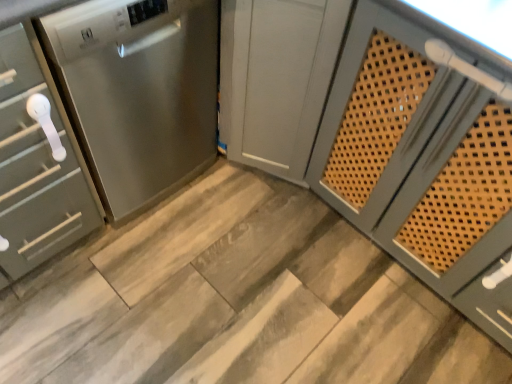
Where is `stainless steel dishwasher at left`? This screenshot has width=512, height=384. stainless steel dishwasher at left is located at coordinates (138, 92).

The image size is (512, 384). What do you see at coordinates (36, 168) in the screenshot?
I see `satin silver cabinet at left, which ranks as the 2th cabinetry in right-to-left order` at bounding box center [36, 168].

Measure the distance between point (x=334, y=167) and camera.

Point (x=334, y=167) and camera are 4.49 feet apart.

Locate an element on the screen. The height and width of the screenshot is (384, 512). stainless steel dishwasher at left is located at coordinates (138, 92).

What's the angular difference between wooden at center and satin silver cabinet at left, which ranks as the 2th cabinetry in right-to-left order,'s facing directions?

They differ by 90.1 degrees in their facing directions.

How far apart are wooden at center and satin silver cabinet at left, which is the 1th cabinetry in left-to-right order?

wooden at center and satin silver cabinet at left, which is the 1th cabinetry in left-to-right order, are 19.90 inches apart.

Does wooden at center have a greater height compared to satin silver cabinet at left, which is the 1th cabinetry in left-to-right order?

Incorrect, the height of wooden at center is not larger of that of satin silver cabinet at left, which is the 1th cabinetry in left-to-right order.

In the image, is wooden at center on the left side or the right side of satin silver cabinet at left, which is the 1th cabinetry in left-to-right order?

Clearly, wooden at center is on the right of satin silver cabinet at left, which is the 1th cabinetry in left-to-right order, in the image.

How many degrees apart are the facing directions of satin gray cabinet at center, the second cabinetry when ordered from left to right, and satin silver cabinet at left, which is the 1th cabinetry in left-to-right order?

89.8 degrees separate the facing orientations of satin gray cabinet at center, the second cabinetry when ordered from left to right, and satin silver cabinet at left, which is the 1th cabinetry in left-to-right order.

Is satin gray cabinet at center, the second cabinetry when ordered from left to right, positioned far away from satin silver cabinet at left, which ranks as the 2th cabinetry in right-to-left order?

satin gray cabinet at center, the second cabinetry when ordered from left to right, is actually quite close to satin silver cabinet at left, which ranks as the 2th cabinetry in right-to-left order.

From the picture: Is satin gray cabinet at center, the second cabinetry when ordered from left to right, positioned behind satin silver cabinet at left, which is the 1th cabinetry in left-to-right order?

No, satin gray cabinet at center, the second cabinetry when ordered from left to right, is in front of satin silver cabinet at left, which is the 1th cabinetry in left-to-right order.

Is stainless steel dishwasher at left with satin silver cabinet at left, which ranks as the 2th cabinetry in right-to-left order?

No, stainless steel dishwasher at left is not in contact with satin silver cabinet at left, which ranks as the 2th cabinetry in right-to-left order.

Would you say stainless steel dishwasher at left is inside or outside satin silver cabinet at left, which ranks as the 2th cabinetry in right-to-left order?

stainless steel dishwasher at left lies outside satin silver cabinet at left, which ranks as the 2th cabinetry in right-to-left order.

Which is closer, (116, 176) or (2, 150)?

Point (116, 176) is farther from the camera than point (2, 150).

Looking at this image, is satin gray cabinet at center, the second cabinetry when ordered from left to right, shorter than stainless steel dishwasher at left?

No.

Considering the relative sizes of satin gray cabinet at center, the 1th cabinetry positioned from the right, and stainless steel dishwasher at left in the image provided, is satin gray cabinet at center, the 1th cabinetry positioned from the right, thinner than stainless steel dishwasher at left?

Yes, satin gray cabinet at center, the 1th cabinetry positioned from the right, is thinner than stainless steel dishwasher at left.

Does satin gray cabinet at center, the second cabinetry when ordered from left to right, have a smaller size compared to stainless steel dishwasher at left?

No, satin gray cabinet at center, the second cabinetry when ordered from left to right, is not smaller than stainless steel dishwasher at left.

How distant is satin gray cabinet at center, the 1th cabinetry positioned from the right, from stainless steel dishwasher at left?

Answer: satin gray cabinet at center, the 1th cabinetry positioned from the right, and stainless steel dishwasher at left are 16.25 inches apart.

Is stainless steel dishwasher at left located within satin silver cabinet at left, which ranks as the 2th cabinetry in right-to-left order?

No, satin silver cabinet at left, which ranks as the 2th cabinetry in right-to-left order, does not contain stainless steel dishwasher at left.

Is satin silver cabinet at left, which is the 1th cabinetry in left-to-right order, wider than stainless steel dishwasher at left?

No, satin silver cabinet at left, which is the 1th cabinetry in left-to-right order, is not wider than stainless steel dishwasher at left.

This screenshot has height=384, width=512. In order to click on the 2nd cabinetry located beneath the stainless steel dishwasher at left (from a real-world perspective) in this screenshot , I will do `click(36, 168)`.

Consider the image. Which object is closer to the camera, satin silver cabinet at left, which ranks as the 2th cabinetry in right-to-left order, or stainless steel dishwasher at left?

satin silver cabinet at left, which ranks as the 2th cabinetry in right-to-left order, is more forward.

Considering the relative positions of stainless steel dishwasher at left and satin gray cabinet at center, the second cabinetry when ordered from left to right, in the image provided, is stainless steel dishwasher at left to the left of satin gray cabinet at center, the second cabinetry when ordered from left to right, from the viewer's perspective?

Yes, stainless steel dishwasher at left is to the left of satin gray cabinet at center, the second cabinetry when ordered from left to right.

Considering the relative sizes of stainless steel dishwasher at left and satin gray cabinet at center, the 1th cabinetry positioned from the right, in the image provided, is stainless steel dishwasher at left taller than satin gray cabinet at center, the 1th cabinetry positioned from the right,?

Incorrect, the height of stainless steel dishwasher at left is not larger of that of satin gray cabinet at center, the 1th cabinetry positioned from the right.

Does stainless steel dishwasher at left come behind satin gray cabinet at center, the second cabinetry when ordered from left to right?

Yes.

From a real-world perspective, between stainless steel dishwasher at left and satin gray cabinet at center, the 1th cabinetry positioned from the right, who is vertically lower?

satin gray cabinet at center, the 1th cabinetry positioned from the right.

Does satin gray cabinet at center, the second cabinetry when ordered from left to right, lie behind wooden at center?

No, it is not.

From a real-world perspective, which object stands above the other?

satin gray cabinet at center, the 1th cabinetry positioned from the right.

Is satin gray cabinet at center, the second cabinetry when ordered from left to right, smaller than wooden at center?

Incorrect, satin gray cabinet at center, the second cabinetry when ordered from left to right, is not smaller in size than wooden at center.

Is there a large distance between satin gray cabinet at center, the second cabinetry when ordered from left to right, and wooden at center?

No, satin gray cabinet at center, the second cabinetry when ordered from left to right, is in close proximity to wooden at center.

You are a GUI agent. You are given a task and a screenshot of the screen. Output one action in this format:
    pyautogui.click(x=<x>, y=<y>)
    Task: Click on the cabinetry on the left of wooden at center
    This screenshot has width=512, height=384.
    Given the screenshot: What is the action you would take?
    pyautogui.click(x=36, y=168)

I want to click on cabinetry in front of the satin silver cabinet at left, which ranks as the 2th cabinetry in right-to-left order, so click(x=396, y=142).

Which object lies nearer to the anchor point stainless steel dishwasher at left, wooden at center or satin silver cabinet at left, which is the 1th cabinetry in left-to-right order?

satin silver cabinet at left, which is the 1th cabinetry in left-to-right order, is positioned closer to the anchor stainless steel dishwasher at left.

Based on their spatial positions, is wooden at center or satin gray cabinet at center, the second cabinetry when ordered from left to right, further from satin silver cabinet at left, which ranks as the 2th cabinetry in right-to-left order?

satin gray cabinet at center, the second cabinetry when ordered from left to right, is positioned further to the anchor satin silver cabinet at left, which ranks as the 2th cabinetry in right-to-left order.

Considering their positions, is satin gray cabinet at center, the second cabinetry when ordered from left to right, positioned closer to stainless steel dishwasher at left than wooden at center?

Among the two, satin gray cabinet at center, the second cabinetry when ordered from left to right, is located nearer to stainless steel dishwasher at left.

When comparing their distances from satin gray cabinet at center, the second cabinetry when ordered from left to right, does wooden at center or stainless steel dishwasher at left seem closer?

Based on the image, stainless steel dishwasher at left appears to be nearer to satin gray cabinet at center, the second cabinetry when ordered from left to right.

Considering their positions, is stainless steel dishwasher at left positioned closer to satin silver cabinet at left, which ranks as the 2th cabinetry in right-to-left order, than satin gray cabinet at center, the second cabinetry when ordered from left to right?

The object closer to satin silver cabinet at left, which ranks as the 2th cabinetry in right-to-left order, is stainless steel dishwasher at left.

Based on their spatial positions, is satin silver cabinet at left, which is the 1th cabinetry in left-to-right order, or wooden at center further from satin gray cabinet at center, the 1th cabinetry positioned from the right?

Among the two, satin silver cabinet at left, which is the 1th cabinetry in left-to-right order, is located further to satin gray cabinet at center, the 1th cabinetry positioned from the right.

Looking at the image, which one is located closer to stainless steel dishwasher at left, satin silver cabinet at left, which is the 1th cabinetry in left-to-right order, or wooden at center?

Based on the image, satin silver cabinet at left, which is the 1th cabinetry in left-to-right order, appears to be nearer to stainless steel dishwasher at left.

Considering their positions, is satin gray cabinet at center, the second cabinetry when ordered from left to right, positioned further to stainless steel dishwasher at left than satin silver cabinet at left, which ranks as the 2th cabinetry in right-to-left order?

satin gray cabinet at center, the second cabinetry when ordered from left to right, lies further to stainless steel dishwasher at left than the other object.

Find the location of a particular element. This screenshot has height=384, width=512. home appliance situated between satin silver cabinet at left, which is the 1th cabinetry in left-to-right order, and satin gray cabinet at center, the 1th cabinetry positioned from the right, from left to right is located at coordinates (138, 92).

Locate an element on the screen. stair between satin silver cabinet at left, which is the 1th cabinetry in left-to-right order, and satin gray cabinet at center, the 1th cabinetry positioned from the right, from left to right is located at coordinates (236, 301).